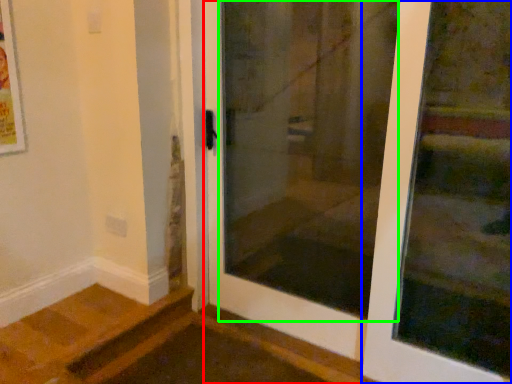
Question: Estimate the real-world distances between objects in this image. Which object is farther from door (highlighted by a red box), door (highlighted by a blue box) or screen door (highlighted by a green box)?

Choices:
 (A) door
 (B) screen door

Answer: (A)